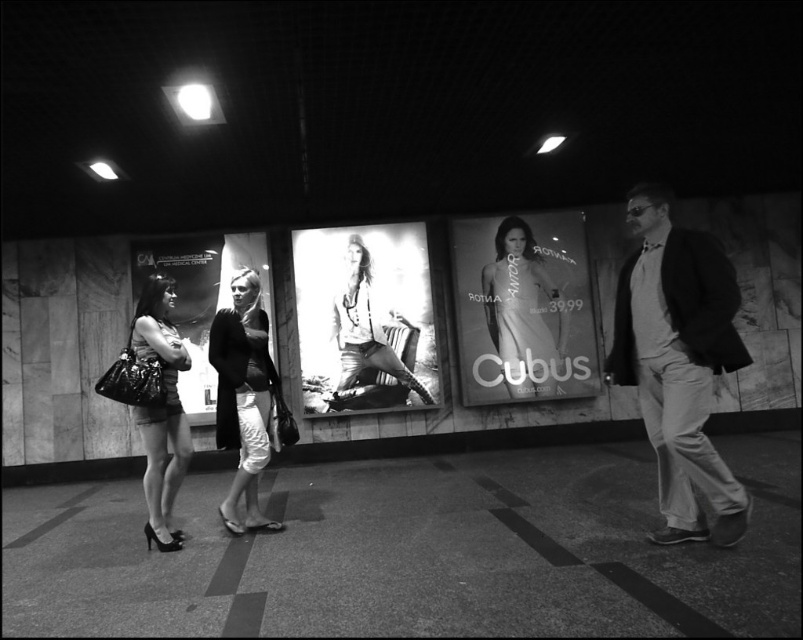
Can you confirm if smooth concrete pavement at lower center is thinner than shiny black purse at center?

No, smooth concrete pavement at lower center is not thinner than shiny black purse at center.

Is smooth concrete pavement at lower center to the right of shiny black purse at center from the viewer's perspective?

Correct, you'll find smooth concrete pavement at lower center to the right of shiny black purse at center.

You are a GUI agent. You are given a task and a screenshot of the screen. Output one action in this format:
    pyautogui.click(x=<x>, y=<y>)
    Task: Click on the smooth concrete pavement at lower center
    This screenshot has width=803, height=640.
    Given the screenshot: What is the action you would take?
    pyautogui.click(x=414, y=552)

Who is positioned more to the left, silky white dress at center or smooth leather jacket at center?

Positioned to the left is smooth leather jacket at center.

Can you confirm if silky white dress at center is positioned above smooth leather jacket at center?

Yes, silky white dress at center is above smooth leather jacket at center.

Which is behind, point (545, 349) or point (337, 324)?

The point (545, 349) is behind.

Locate an element on the screen. This screenshot has height=640, width=803. silky white dress at center is located at coordinates (524, 314).

Who is taller, light gray cotton pants at right or matte black coat at center?

light gray cotton pants at right is taller.

Who is higher up, light gray cotton pants at right or matte black coat at center?

Positioned higher is light gray cotton pants at right.

Is point (720, 356) positioned before point (214, 339)?

Yes, it is.

Find the location of a particular element. The width and height of the screenshot is (803, 640). light gray cotton pants at right is located at coordinates (679, 362).